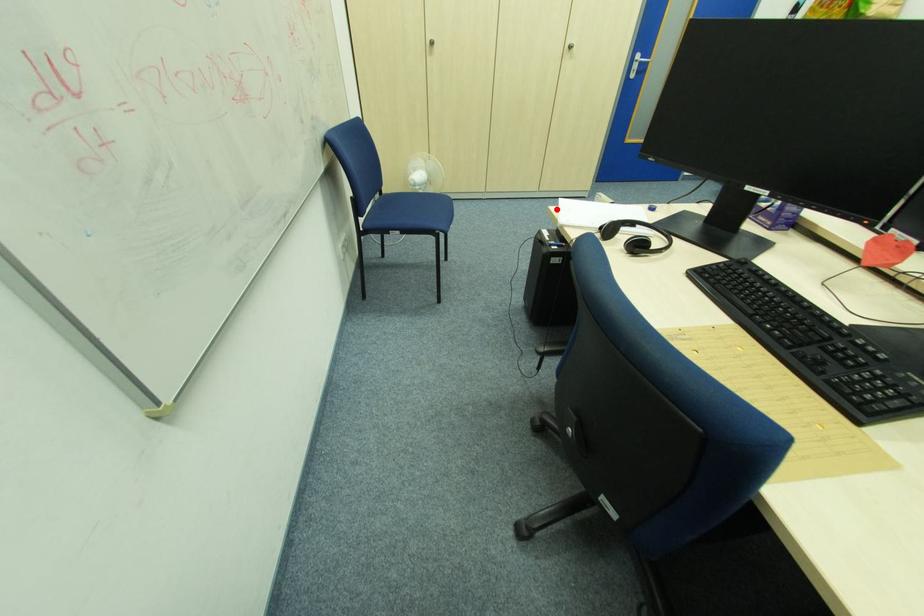
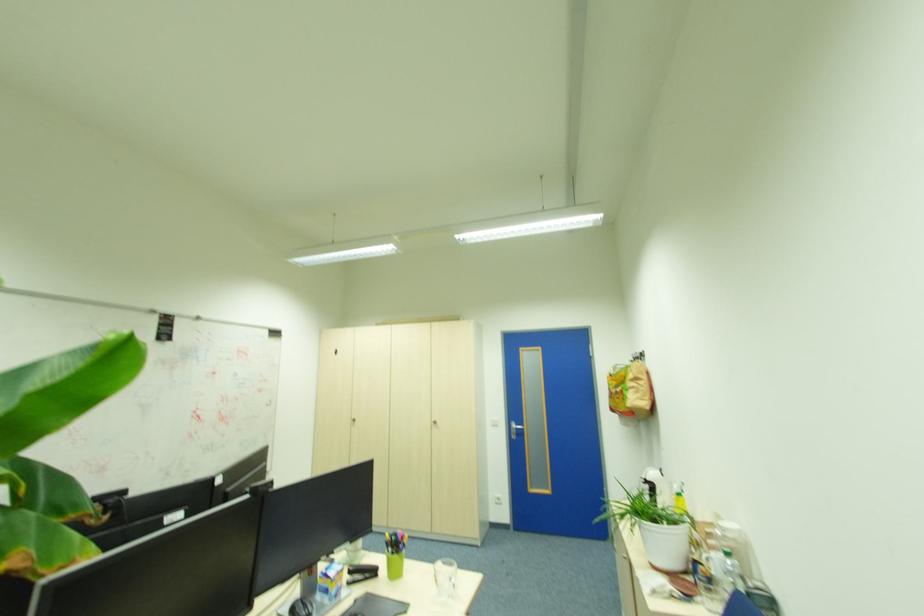
Question: I am providing you with two images of the same scene from different viewpoints. A red point is marked on the first image. At the location where the point appears in image 1, is it still visible in image 2?

Choices:
 (A) Yes
 (B) No

Answer: (B)